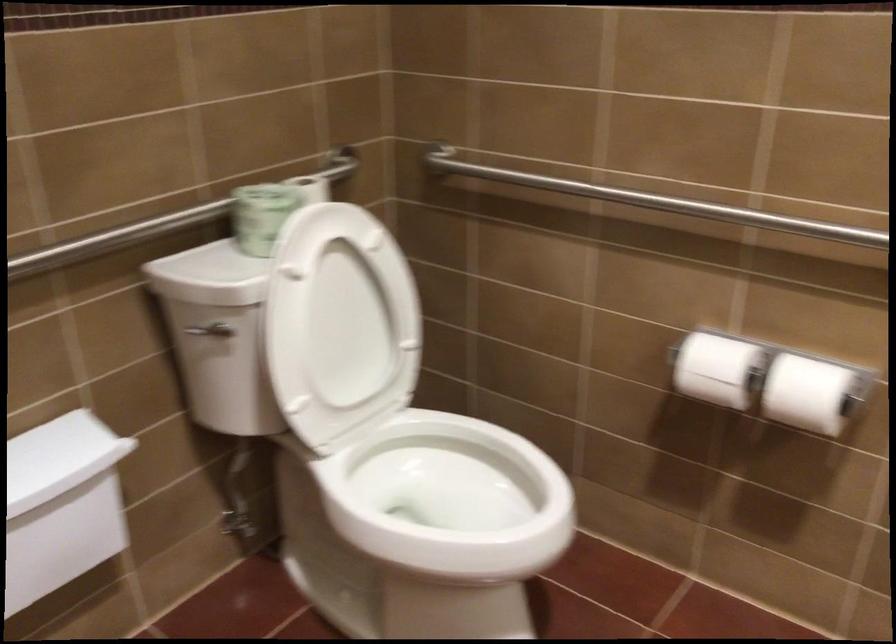
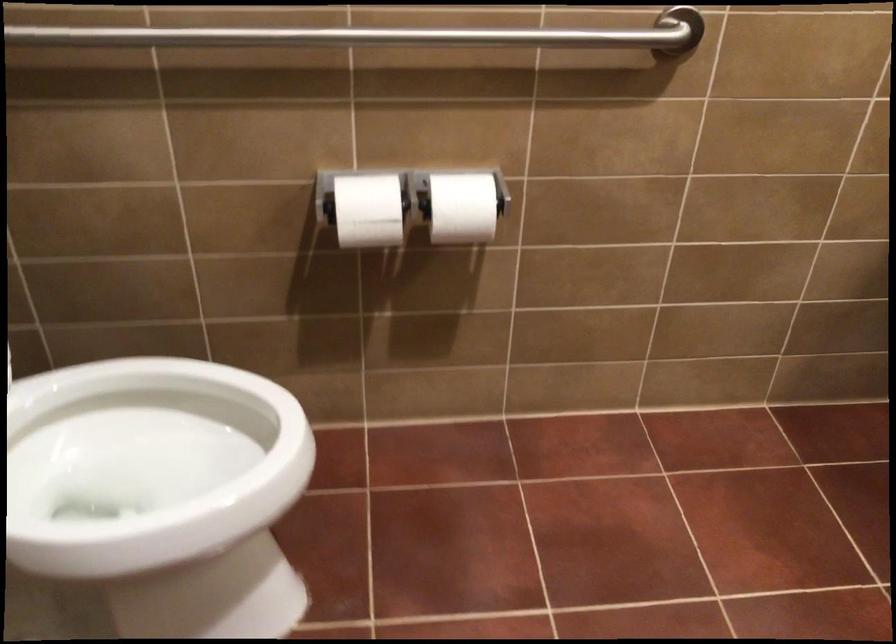
The point at (711, 364) is marked in the first image. Where is the corresponding point in the second image?

(367, 210)